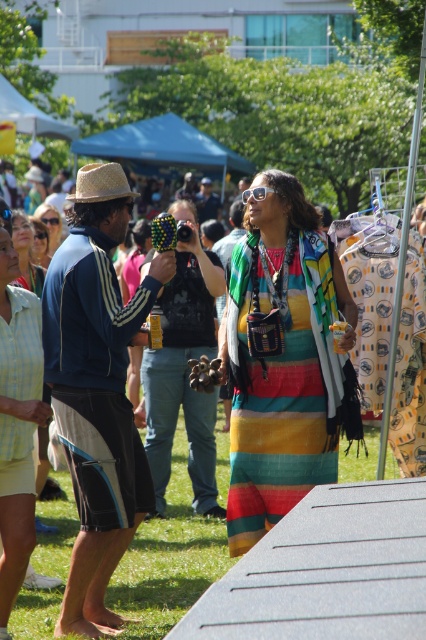
You are a photographer trying to capture the entire scene in one shot. Given that the green grass at lower center and the matte black sunglasses at upper center are both in your frame, which object would appear smaller in the photo?

The green grass at lower center would appear smaller in the photo because it has a smaller size compared to the matte black sunglasses at upper center.

You are a fashion designer observing the scene. You need to determine which item is bigger between the multicolored striped dress at center and the matte black sunglasses at upper center. Can you identify which one is larger?

The multicolored striped dress at center is larger in size than the matte black sunglasses at upper center.